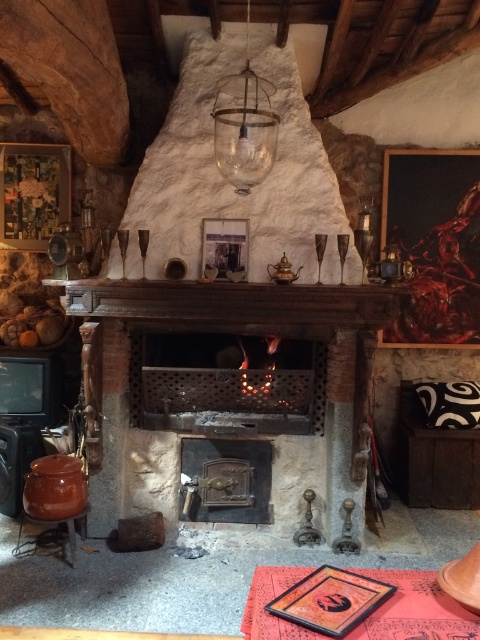
Can you confirm if transparent glass lamp at upper center is positioned to the right of brown wooden stool at lower left?

Indeed, transparent glass lamp at upper center is positioned on the right side of brown wooden stool at lower left.

Does transparent glass lamp at upper center have a lesser height compared to brown wooden stool at lower left?

No.

Is point (267, 90) positioned behind point (34, 547)?

That is False.

Image resolution: width=480 pixels, height=640 pixels. I want to click on transparent glass lamp at upper center, so click(x=244, y=125).

Looking at this image, which is more to the left, brown wooden mantle at center or brown wooden stool at lower left?

brown wooden stool at lower left is more to the left.

Is point (131, 284) behind point (27, 541)?

No.

Identify the location of brown wooden mantle at center. (236, 301).

Is rustic wood fireplace at center further to camera compared to transparent glass lamp at upper center?

Yes, rustic wood fireplace at center is behind transparent glass lamp at upper center.

Does rustic wood fireplace at center appear under transparent glass lamp at upper center?

Yes, rustic wood fireplace at center is below transparent glass lamp at upper center.

Does point (127, 408) come closer to viewer compared to point (226, 88)?

No.

Find the location of a particular element. Image resolution: width=480 pixels, height=640 pixels. rustic wood fireplace at center is located at coordinates (232, 332).